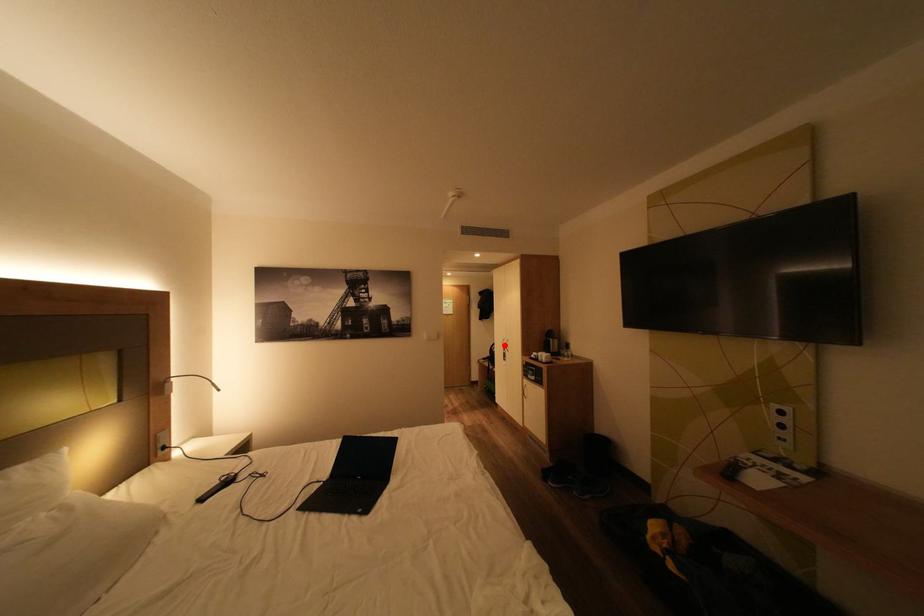
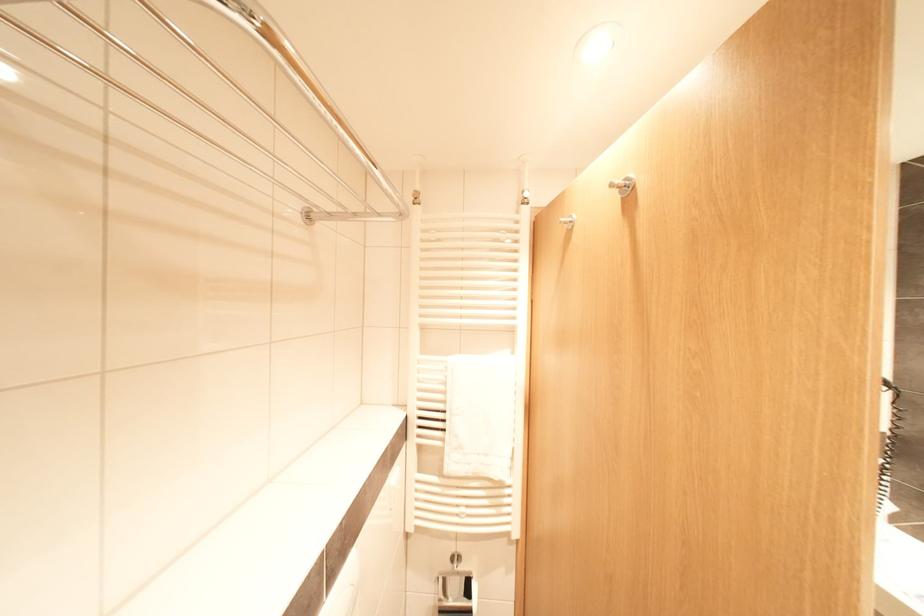
Question: I am providing you with two images of the same scene from different viewpoints. A red point is marked on the first image. At the location where the point appears in image 1, is it still visible in image 2?

Choices:
 (A) Yes
 (B) No

Answer: (B)